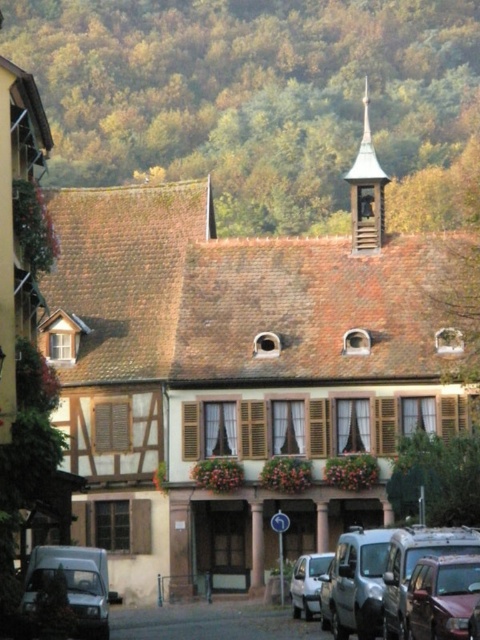
Can you confirm if metallic silver car at lower right is thinner than metallic silver van at lower left?

Yes.

Is point (434, 566) closer to camera compared to point (98, 586)?

That is True.

Image resolution: width=480 pixels, height=640 pixels. What are the coordinates of `metallic silver car at lower right` in the screenshot? It's located at (442, 596).

The image size is (480, 640). What do you see at coordinates (367, 189) in the screenshot? I see `green copper spire at upper center` at bounding box center [367, 189].

Can you confirm if green copper spire at upper center is positioned to the right of white matte car at lower center?

Yes, green copper spire at upper center is to the right of white matte car at lower center.

You are a GUI agent. You are given a task and a screenshot of the screen. Output one action in this format:
    pyautogui.click(x=<x>, y=<y>)
    Task: Click on the green copper spire at upper center
    Image resolution: width=480 pixels, height=640 pixels.
    Given the screenshot: What is the action you would take?
    pyautogui.click(x=367, y=189)

Find the location of a particular element. The width and height of the screenshot is (480, 640). green copper spire at upper center is located at coordinates (367, 189).

Which is behind, point (411, 568) or point (457, 636)?

The point (411, 568) is behind.

This screenshot has width=480, height=640. Identify the location of metallic silver van at lower right. (384, 572).